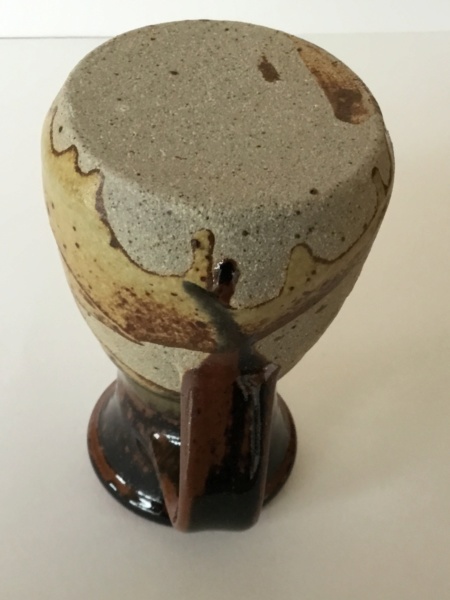
Where is `beige counter`? The width and height of the screenshot is (450, 600). beige counter is located at coordinates (304, 545).